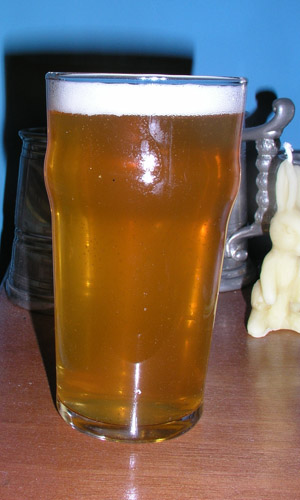
Where is `wooden table in front of beer`? This screenshot has height=500, width=300. wooden table in front of beer is located at coordinates (123, 477).